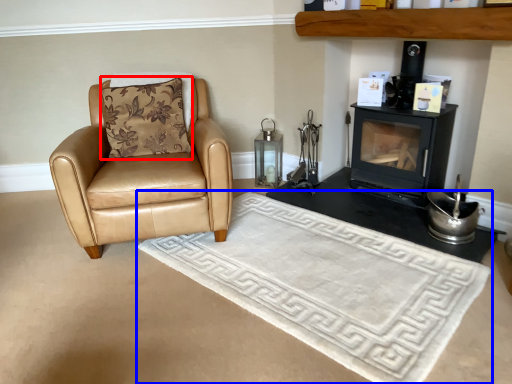
Question: Which object is closer to the camera taking this photo, pillow (highlighted by a red box) or mat (highlighted by a blue box)?

Choices:
 (A) pillow
 (B) mat

Answer: (B)